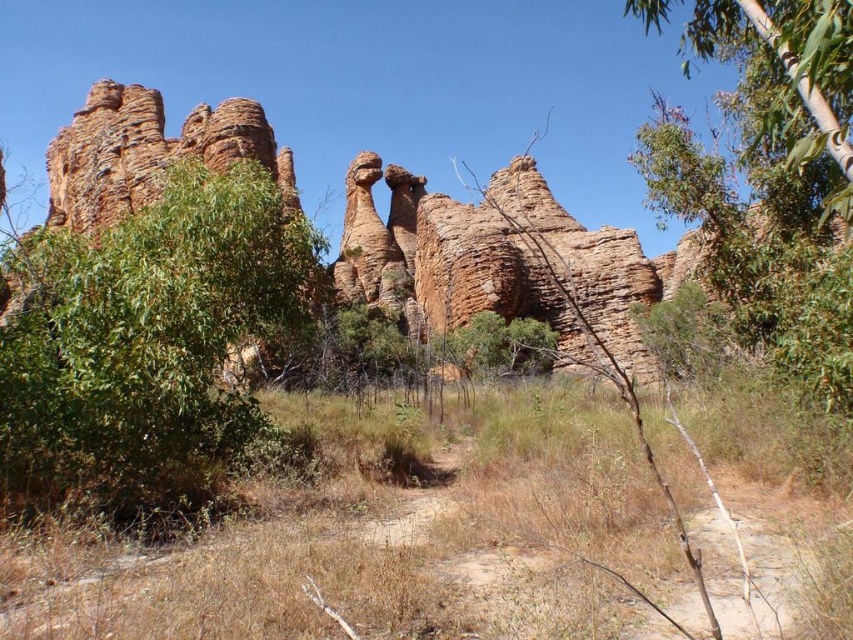
Identify the location of green leafy bush at left. (148, 346).

Does point (131, 561) come farther from viewer compared to point (798, 116)?

No, it is not.

How much distance is there between dry grass at lower center and green leafy tree at upper right?

→ dry grass at lower center and green leafy tree at upper right are 42.97 meters apart from each other.

I want to click on dry grass at lower center, so click(x=396, y=540).

You are a GUI agent. You are given a task and a screenshot of the screen. Output one action in this format:
    pyautogui.click(x=<x>, y=<y>)
    Task: Click on the dry grass at lower center
    The height and width of the screenshot is (640, 853).
    Given the screenshot: What is the action you would take?
    pyautogui.click(x=396, y=540)

Which is above, dry grass at lower center or green leafy bush at left?

green leafy bush at left is above.

Can you confirm if dry grass at lower center is positioned to the right of green leafy bush at left?

Indeed, dry grass at lower center is positioned on the right side of green leafy bush at left.

Is point (566, 422) in front of point (190, 248)?

No, it is behind (190, 248).

Where is `dry grass at lower center`? The image size is (853, 640). dry grass at lower center is located at coordinates (396, 540).